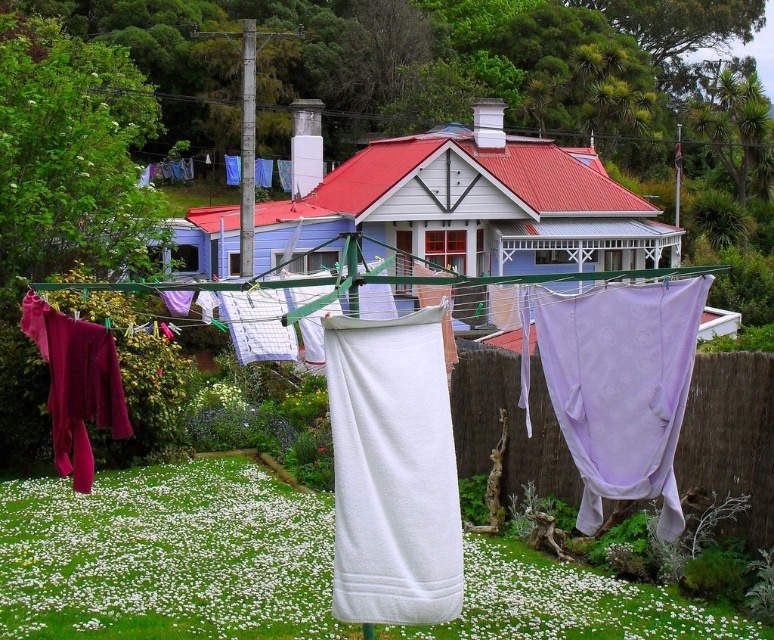
Between white towel at center and white fabric at center, which one has less height?

white fabric at center is shorter.

Between white towel at center and white fabric at center, which one is positioned lower?

white fabric at center

Between point (368, 470) and point (488, 436), which one is positioned in front?

Point (368, 470)

Where is `white towel at center`? This screenshot has height=640, width=774. white towel at center is located at coordinates (392, 470).

Does point (420, 557) lie behind point (584, 472)?

No, (420, 557) is in front of (584, 472).

Who is positioned more to the left, white towel at center or lavender sheer fabric at center?

white towel at center

Who is more forward, (362, 476) or (594, 525)?

Point (362, 476) is more forward.

I want to click on white towel at center, so click(x=392, y=470).

Which of these two, white soft grass at center or white fabric at center, stands shorter?

Standing shorter between the two is white soft grass at center.

Is point (135, 477) positioned behind point (543, 472)?

That is True.

Where is `white soft grass at center`? The image size is (774, 640). white soft grass at center is located at coordinates (166, 556).